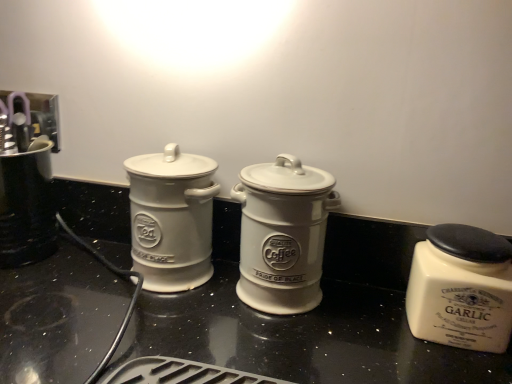
Question: Considering the positions of white ceramic garlic jar at right, the third kitchen appliance from the left, and white ceramic jar at left, acting as the third kitchen appliance starting from the right, in the image, is white ceramic garlic jar at right, the third kitchen appliance from the left, wider or thinner than white ceramic jar at left, acting as the third kitchen appliance starting from the right,?

Choices:
 (A) thin
 (B) wide

Answer: (B)

Question: Is point (458, 281) positioned closer to the camera than point (186, 264)?

Choices:
 (A) closer
 (B) farther

Answer: (A)

Question: Considering the real-world distances, which object is closest to the white ceramic jar at left, positioned as the 1th kitchen appliance in left-to-right order?

Choices:
 (A) white ceramic coffee canister at center, acting as the 2th kitchen appliance starting from the right
 (B) brushed metal coffee maker at left
 (C) white ceramic garlic jar at right, the third kitchen appliance from the left

Answer: (A)

Question: Which object is positioned farthest from the white ceramic coffee canister at center, acting as the 2th kitchen appliance starting from the right?

Choices:
 (A) brushed metal coffee maker at left
 (B) white ceramic garlic jar at right, which is the 1th kitchen appliance in right-to-left order
 (C) white ceramic jar at left, acting as the third kitchen appliance starting from the right

Answer: (A)